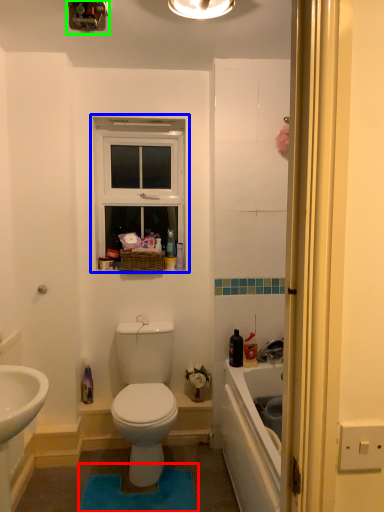
Question: Which object is the farthest from bath mat (highlighted by a red box)? Choose among these: window (highlighted by a blue box) or light fixture (highlighted by a green box).

Choices:
 (A) window
 (B) light fixture

Answer: (B)